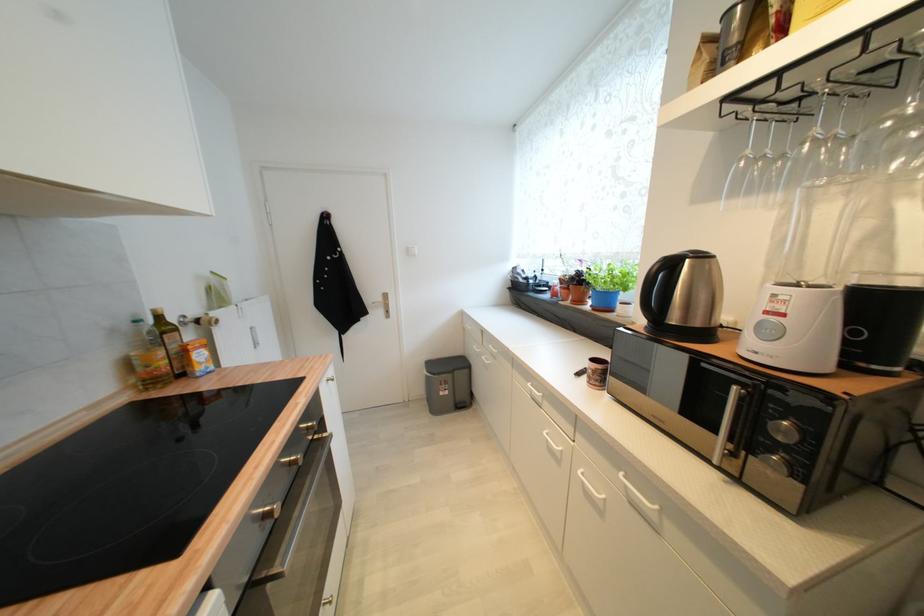
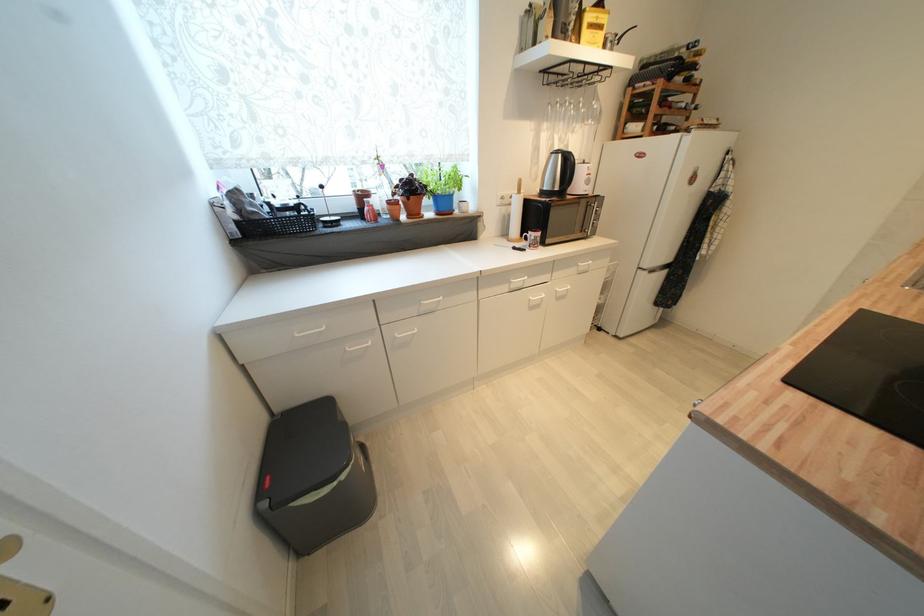
Find the pixel in the second image that matches (x=517, y=283) in the first image.

(242, 225)